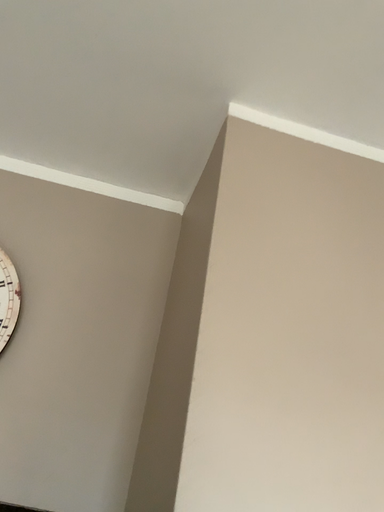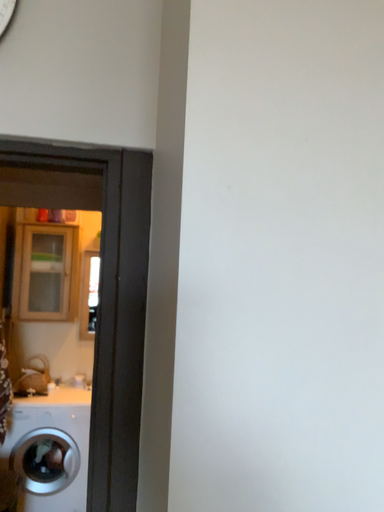
Question: How did the camera likely rotate when shooting the video?

Choices:
 (A) rotated upward
 (B) rotated downward

Answer: (B)